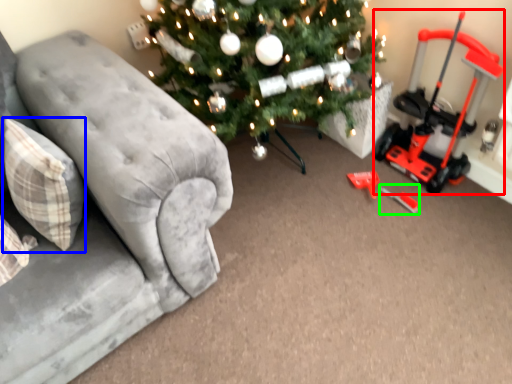
Question: Estimate the real-world distances between objects in this image. Which object is closer to equipment (highlighted by a red box), pillow (highlighted by a blue box) or toy (highlighted by a green box)?

Choices:
 (A) pillow
 (B) toy

Answer: (B)